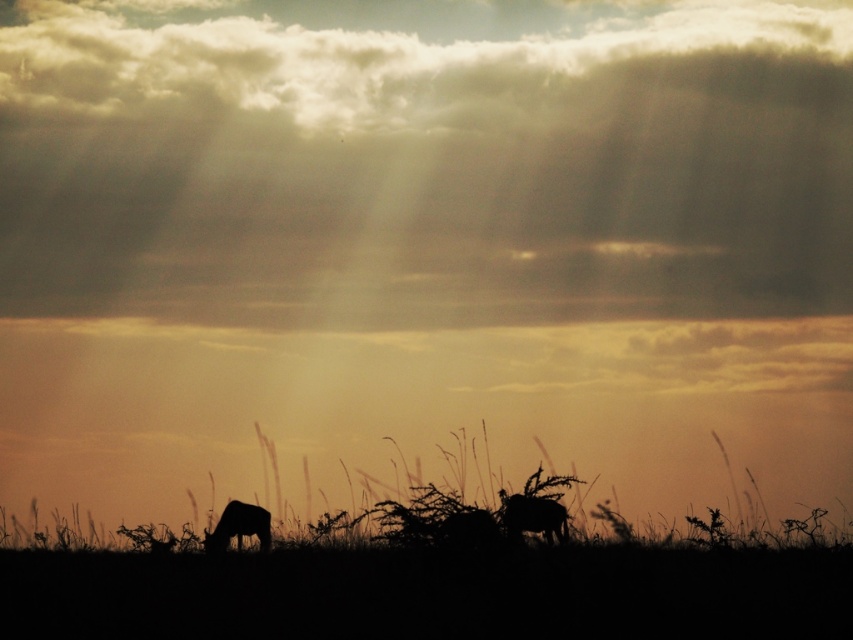
Question: Can you confirm if silhouette fur at center is wider than silhouette elephant at lower left?

Choices:
 (A) yes
 (B) no

Answer: (A)

Question: Which object is farther from the camera taking this photo?

Choices:
 (A) silhouette fur at center
 (B) cloudy sky at upper center

Answer: (B)

Question: Which object is the farthest from the cloudy sky at upper center?

Choices:
 (A) silhouette fur at center
 (B) silhouette elephant at lower left

Answer: (B)

Question: Is silhouette fur at center further to the viewer compared to silhouette elephant at lower left?

Choices:
 (A) yes
 (B) no

Answer: (B)

Question: Which point is closer to the camera?

Choices:
 (A) cloudy sky at upper center
 (B) silhouette elephant at lower left

Answer: (B)

Question: Does cloudy sky at upper center appear over silhouette elephant at lower left?

Choices:
 (A) yes
 (B) no

Answer: (A)